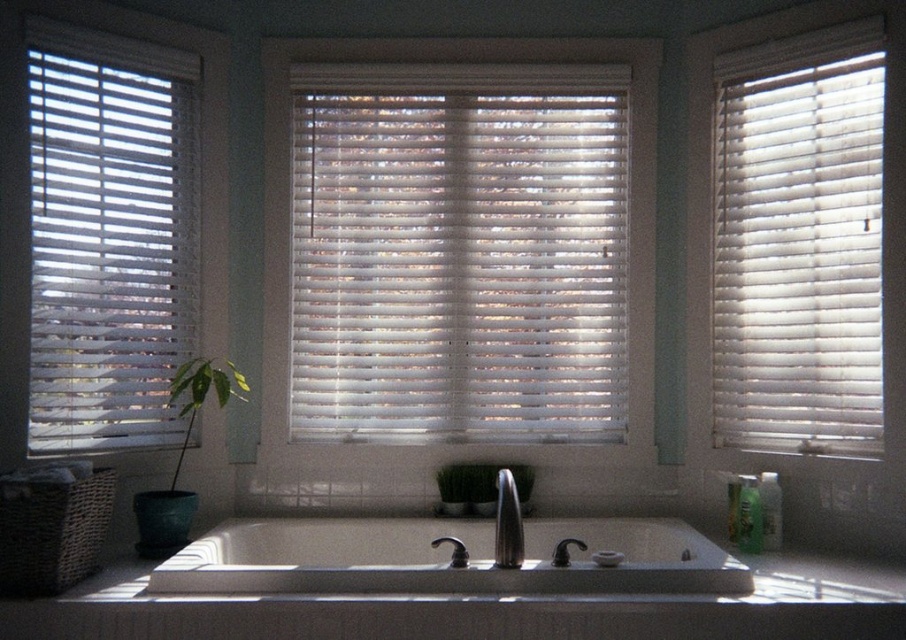
Question: Which of the following is the farthest from the observer?

Choices:
 (A) (498, 481)
 (B) (836, 451)
 (C) (176, 396)

Answer: (A)

Question: Does white wood blinds at left appear over green leafy plant at left?

Choices:
 (A) yes
 (B) no

Answer: (A)

Question: Which of the following is the closest to the observer?

Choices:
 (A) (172, 474)
 (B) (408, 168)

Answer: (A)

Question: Can you confirm if white wood blinds at center is bigger than green matte plant at center?

Choices:
 (A) no
 (B) yes

Answer: (B)

Question: Does white wood blinds at center lie behind white wood blinds at left?

Choices:
 (A) no
 (B) yes

Answer: (B)

Question: Which of the following is the closest to the observer?

Choices:
 (A) (763, 296)
 (B) (492, 492)
 (C) (169, 392)

Answer: (C)